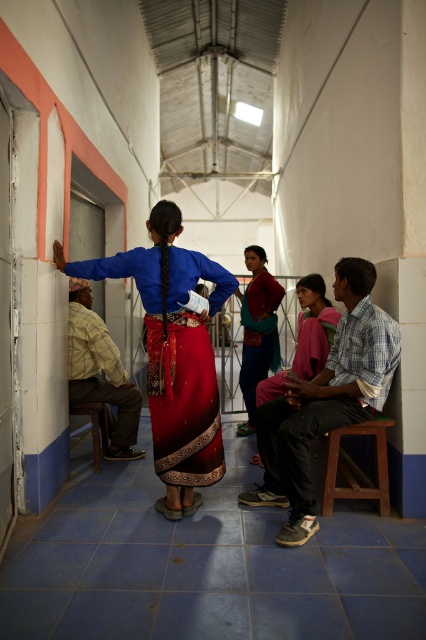
Question: Does checkered fabric shirt at center have a smaller size compared to brown wooden stool at lower right?

Choices:
 (A) yes
 (B) no

Answer: (B)

Question: Can you confirm if matte blue blouse at center is thinner than checkered fabric shirt at center?

Choices:
 (A) no
 (B) yes

Answer: (A)

Question: Which point is closer to the camera taking this photo?

Choices:
 (A) (256, 458)
 (B) (258, 264)

Answer: (A)

Question: Which is farther from the brown wooden stool at lower right?

Choices:
 (A) pink fabric skirt at center
 (B) matte red dress at center
 (C) matte blue blouse at center

Answer: (B)

Question: Is yellow plaid shirt at left thinner than matte red dress at center?

Choices:
 (A) no
 (B) yes

Answer: (A)

Question: Estimate the real-world distances between objects in this image. Which object is farther from the matte red dress at center?

Choices:
 (A) yellow plaid shirt at left
 (B) pink fabric skirt at center
 (C) matte blue blouse at center

Answer: (C)